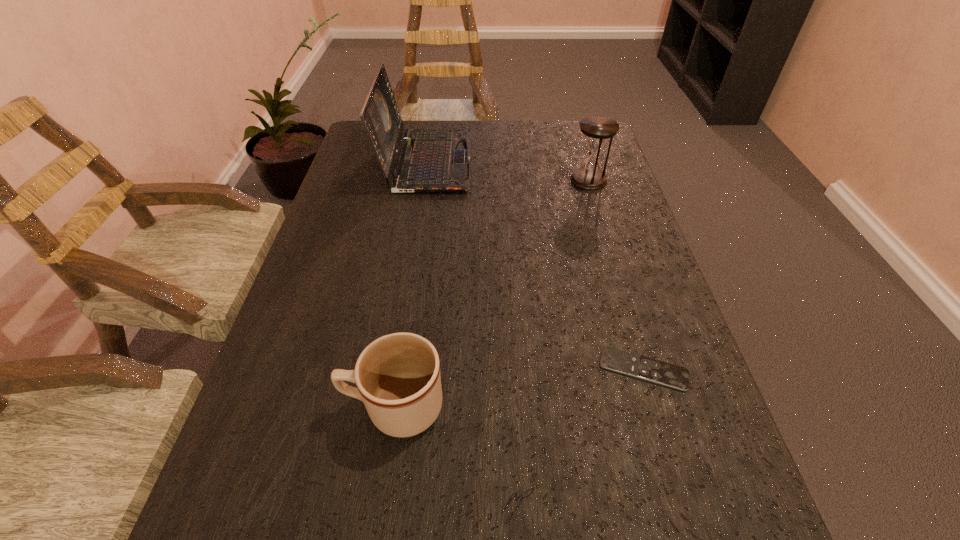
Locate an element on the screen. laptop computer present at the left edge is located at coordinates (431, 160).

I want to click on mug situated at the left edge, so click(x=398, y=379).

This screenshot has width=960, height=540. I want to click on hourglass that is at the right edge, so click(x=597, y=129).

This screenshot has width=960, height=540. In order to click on remote control situated at the right edge in this screenshot , I will do [x=659, y=372].

Locate an element on the screen. The width and height of the screenshot is (960, 540). object located at the far left corner is located at coordinates (431, 160).

Where is `free region at the far edge of the desktop`? The width and height of the screenshot is (960, 540). free region at the far edge of the desktop is located at coordinates pyautogui.click(x=535, y=132).

In the image, there is a desktop. Where is `free space at the left edge`? This screenshot has height=540, width=960. free space at the left edge is located at coordinates (339, 351).

This screenshot has height=540, width=960. In the image, there is a desktop. In order to click on vacant space at the right edge in this screenshot , I will do `click(605, 199)`.

This screenshot has width=960, height=540. In order to click on free spot between the laptop computer and the mug in this screenshot , I will do `click(411, 284)`.

Where is `empty location between the laptop computer and the remote control`? The image size is (960, 540). empty location between the laptop computer and the remote control is located at coordinates (536, 265).